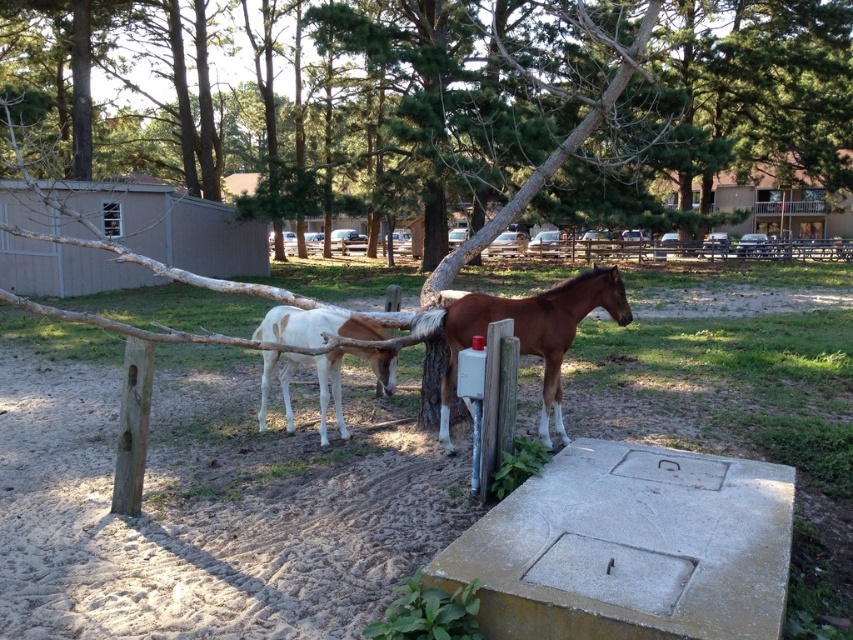
You are standing at the entrance of the fenced area and want to locate the green leafy tree at center. Based on the coordinates provided, in which general direction should you look to find it?

The green leafy tree at center is located at coordinates approximately 0.156 on the x axis and 0.669 on the y axis. Since the entrance is at the origin point, you should look towards the lower left direction to find the green leafy tree at center.

Based on the photo, you are a photographer trying to capture the green leafy tree at center and the brown wooden fence at center in your shot. Which object will appear larger in your photo?

The green leafy tree at center will appear larger in the photo because it is closer to the viewer than the brown wooden fence at center.